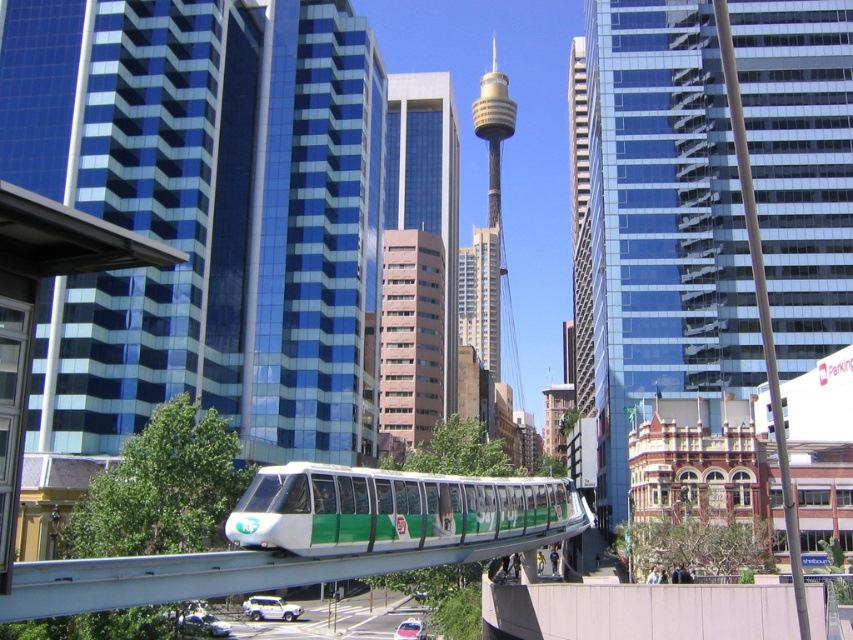
Question: Is pink glass tower at center above green matte monorail at center?

Choices:
 (A) yes
 (B) no

Answer: (A)

Question: Which object is closer to the camera taking this photo?

Choices:
 (A) glassy blue skyscraper at center
 (B) pink smooth building at center
 (C) green matte monorail at center

Answer: (C)

Question: Is pink glass tower at center to the left of pink smooth building at center from the viewer's perspective?

Choices:
 (A) yes
 (B) no

Answer: (B)

Question: Is glassy blue skyscraper at center positioned in front of pink smooth building at center?

Choices:
 (A) no
 (B) yes

Answer: (B)

Question: Which point appears farthest from the camera in this image?

Choices:
 (A) (387, 220)
 (B) (367, 508)

Answer: (A)

Question: Which object is the farthest from the green matte monorail at center?

Choices:
 (A) pink smooth building at center
 (B) glassy blue skyscraper at center
 (C) pink glass tower at center

Answer: (C)